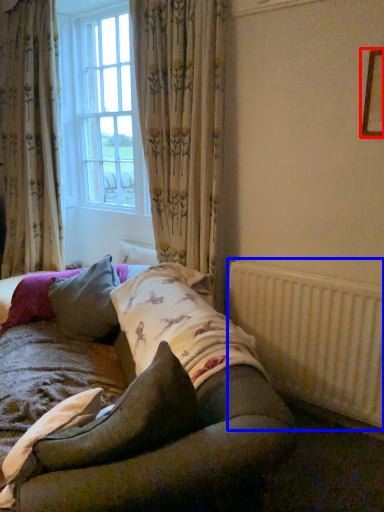
Question: Among these objects, which one is farthest to the camera, picture frame (highlighted by a red box) or radiator (highlighted by a blue box)?

Choices:
 (A) picture frame
 (B) radiator

Answer: (B)